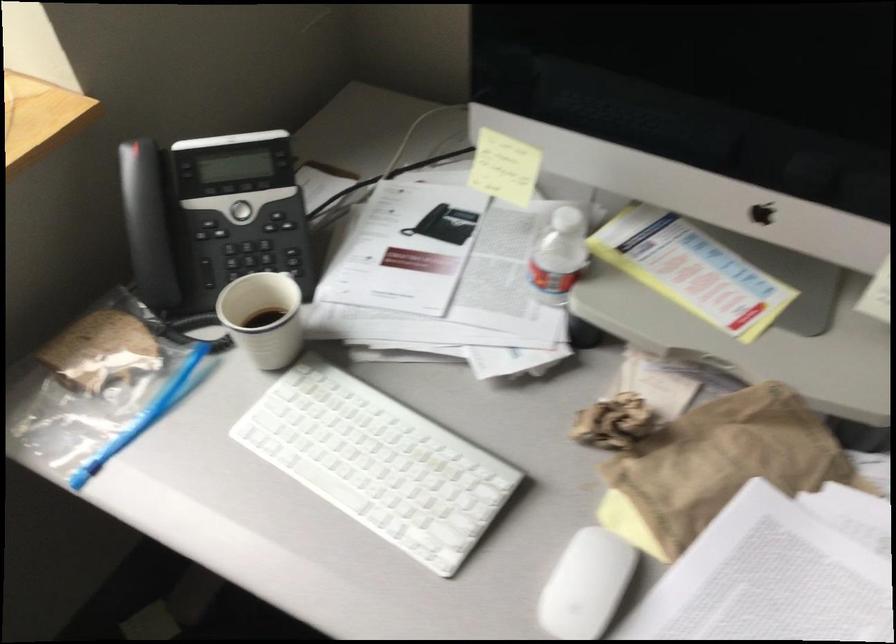
Locate an element on the screen. The width and height of the screenshot is (896, 644). phone navigation button is located at coordinates (259, 250).